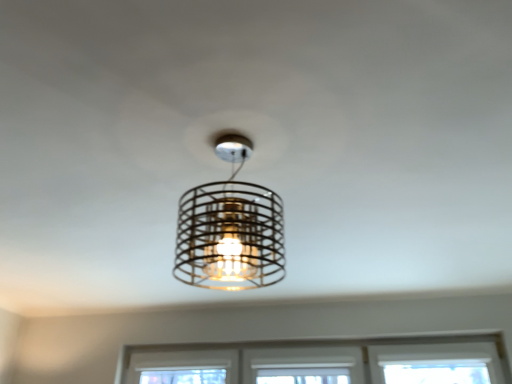
At what (x,y) coordinates should I click in order to perform the action: click on metallic wire cage at center. Please return your answer as a coordinate pair (x, y). Looking at the image, I should click on (230, 229).

What do you see at coordinates (230, 229) in the screenshot? Image resolution: width=512 pixels, height=384 pixels. I see `metallic wire cage at center` at bounding box center [230, 229].

Describe the element at coordinates (321, 361) in the screenshot. The height and width of the screenshot is (384, 512). I see `clear glass window at center` at that location.

Identify the location of clear glass window at center. coord(321,361).

At what (x,y) coordinates should I click in order to perform the action: click on metallic wire cage at center. Please return your answer as a coordinate pair (x, y). This screenshot has height=384, width=512. Looking at the image, I should click on (230, 229).

Is clear glass window at center to the left of metallic wire cage at center from the viewer's perspective?

Incorrect, clear glass window at center is not on the left side of metallic wire cage at center.

Relative to metallic wire cage at center, is clear glass window at center in front or behind?

Clearly, clear glass window at center is behind metallic wire cage at center.

Does point (503, 342) come behind point (248, 238)?

Yes, it is behind point (248, 238).

From the image's perspective, is clear glass window at center located above or below metallic wire cage at center?

Based on their image positions, clear glass window at center is located beneath metallic wire cage at center.

From a real-world perspective, which object rests below the other?

clear glass window at center.

In terms of width, does clear glass window at center look wider or thinner when compared to metallic wire cage at center?

Considering their sizes, clear glass window at center looks slimmer than metallic wire cage at center.

Looking at this image, from their relative heights in the image, would you say clear glass window at center is taller or shorter than metallic wire cage at center?

Considering their sizes, clear glass window at center has less height than metallic wire cage at center.

Does clear glass window at center have a smaller size compared to metallic wire cage at center?

Actually, clear glass window at center might be larger than metallic wire cage at center.

Is clear glass window at center completely or partially outside of metallic wire cage at center?

That's correct, clear glass window at center is outside of metallic wire cage at center.

Is clear glass window at center not near metallic wire cage at center?

Absolutely, clear glass window at center is distant from metallic wire cage at center.

In the scene shown: Could you tell me if clear glass window at center is turned towards metallic wire cage at center?

Yes, clear glass window at center is turned towards metallic wire cage at center.

How different are the orientations of clear glass window at center and metallic wire cage at center in degrees?

They differ by 2.39 degrees in their facing directions.

You are a GUI agent. You are given a task and a screenshot of the screen. Output one action in this format:
    pyautogui.click(x=<x>, y=<y>)
    Task: Click on the lamp in front of the clear glass window at center
    The width and height of the screenshot is (512, 384).
    Given the screenshot: What is the action you would take?
    pyautogui.click(x=230, y=229)

Looking at this image, which is more to the right, metallic wire cage at center or clear glass window at center?

clear glass window at center is more to the right.

Relative to clear glass window at center, is metallic wire cage at center in front or behind?

metallic wire cage at center is in front of clear glass window at center.

Which is closer to the camera, (189,214) or (478,367)?

Point (189,214) is positioned closer to the camera compared to point (478,367).

Consider the image. From the image's perspective, is metallic wire cage at center on top of clear glass window at center?

Yes.

From a real-world perspective, is metallic wire cage at center below clear glass window at center?

Incorrect, from a real-world perspective, metallic wire cage at center is higher than clear glass window at center.

Considering the sizes of objects metallic wire cage at center and clear glass window at center in the image provided, who is thinner, metallic wire cage at center or clear glass window at center?

With smaller width is clear glass window at center.

In terms of height, does metallic wire cage at center look taller or shorter compared to clear glass window at center?

Considering their sizes, metallic wire cage at center has more height than clear glass window at center.

In terms of size, does metallic wire cage at center appear bigger or smaller than clear glass window at center?

In the image, metallic wire cage at center appears to be smaller than clear glass window at center.

Is clear glass window at center located within metallic wire cage at center?

Actually, clear glass window at center is outside metallic wire cage at center.

Looking at this image, does metallic wire cage at center touch clear glass window at center?

No, metallic wire cage at center is not in contact with clear glass window at center.

Is metallic wire cage at center oriented towards clear glass window at center?

No, metallic wire cage at center is not turned towards clear glass window at center.

From the picture: What's the angular difference between metallic wire cage at center and clear glass window at center's facing directions?

2.39 degrees.

Measure the distance between metallic wire cage at center and clear glass window at center.

5.63 feet.

The image size is (512, 384). What are the coordinates of `window directly beneath the metallic wire cage at center (from a real-world perspective)` in the screenshot? It's located at (321, 361).

Locate an element on the screen. window that is below the metallic wire cage at center (from the image's perspective) is located at coordinates (321, 361).

Where is `window behind the metallic wire cage at center`? window behind the metallic wire cage at center is located at coordinates (321, 361).